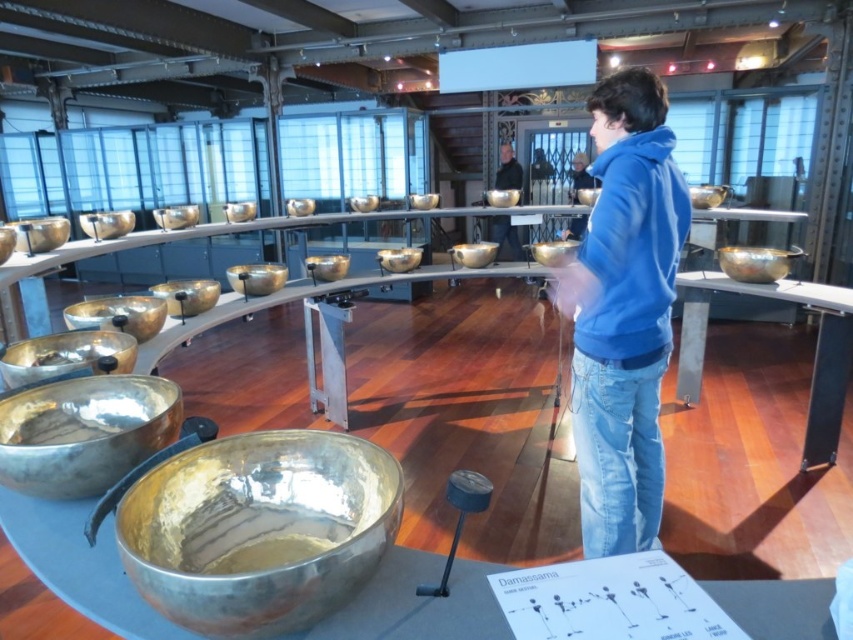
Question: Does blue cotton hoodie at center appear on the right side of matte black jacket at center?

Choices:
 (A) yes
 (B) no

Answer: (B)

Question: Which point is farther to the camera?

Choices:
 (A) matte black jacket at center
 (B) blue cotton hoodie at center

Answer: (A)

Question: Where is blue cotton hoodie at center located in relation to matte black jacket at center in the image?

Choices:
 (A) left
 (B) right

Answer: (A)

Question: Does blue cotton hoodie at center have a greater width compared to matte black jacket at center?

Choices:
 (A) yes
 (B) no

Answer: (A)

Question: Which point appears farthest from the camera in this image?

Choices:
 (A) (503, 152)
 (B) (566, 310)

Answer: (A)